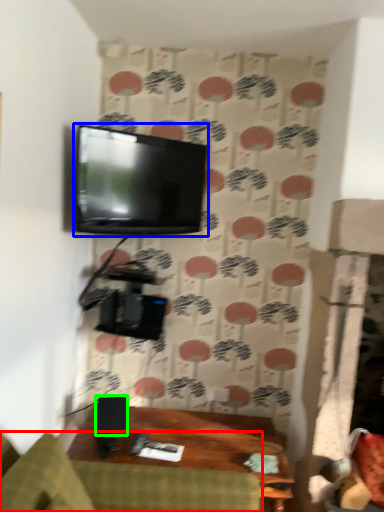
Question: Considering the real-world distances, which object is closest to studio couch (highlighted by a red box)? television (highlighted by a blue box) or speaker (highlighted by a green box).

Choices:
 (A) television
 (B) speaker

Answer: (B)